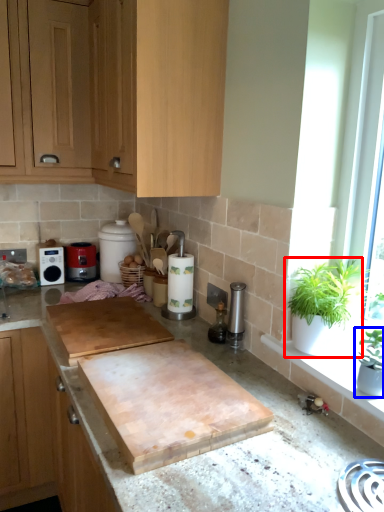
Question: Which of the following is the farthest to the observer, houseplant (highlighted by a red box) or houseplant (highlighted by a blue box)?

Choices:
 (A) houseplant
 (B) houseplant

Answer: (A)